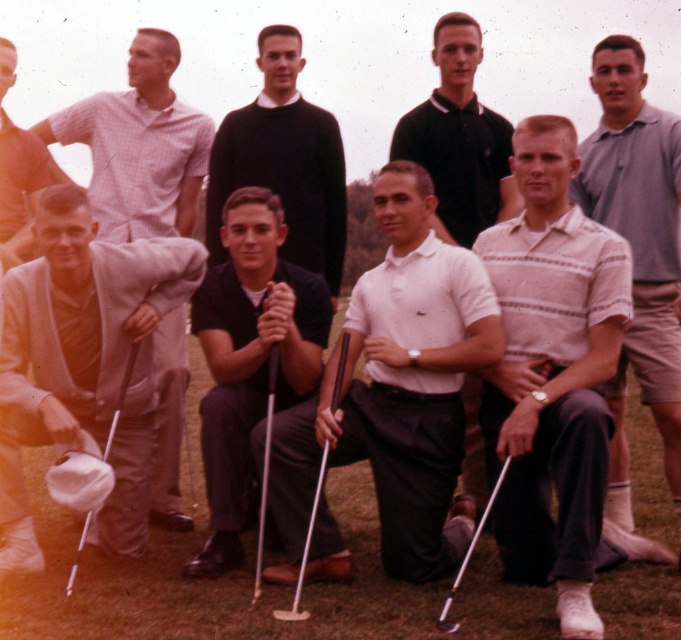
Does point (7, 90) lie behind point (285, 612)?

Yes, point (7, 90) is farther from viewer.

Does light brown wool sweater at lower left lie behind white wood golf club at center?

Yes, it is behind white wood golf club at center.

Who is more forward, (16, 179) or (338, 401)?

Positioned in front is point (338, 401).

You are a GUI agent. You are given a task and a screenshot of the screen. Output one action in this format:
    pyautogui.click(x=<x>, y=<y>)
    Task: Click on the light brown wool sweater at lower left
    The height and width of the screenshot is (640, 681).
    Given the screenshot: What is the action you would take?
    point(18,170)

Who is lower down, matte white golf club at left or white matte polo shirt at center?

Positioned lower is white matte polo shirt at center.

Find the location of a particular element. The height and width of the screenshot is (640, 681). matte white golf club at left is located at coordinates (140, 147).

Is point (159, 406) closer to viewer compared to point (464, 228)?

Yes, it is in front of point (464, 228).

The width and height of the screenshot is (681, 640). What are the coordinates of `matte white golf club at left` in the screenshot? It's located at (140, 147).

In the scene shown: Is gray cotton polo shirt at center shorter than matte white golf club at left?

Incorrect, gray cotton polo shirt at center's height does not fall short of matte white golf club at left's.

Describe the element at coordinates (637, 250) in the screenshot. The height and width of the screenshot is (640, 681). I see `gray cotton polo shirt at center` at that location.

Where is `gray cotton polo shirt at center`? This screenshot has height=640, width=681. gray cotton polo shirt at center is located at coordinates tap(637, 250).